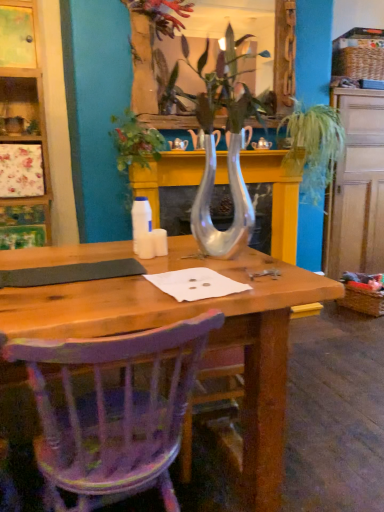
The image size is (384, 512). Find the location of `empty space that is ontop of purple painted wood chair at lower left`. empty space that is ontop of purple painted wood chair at lower left is located at coordinates (103, 304).